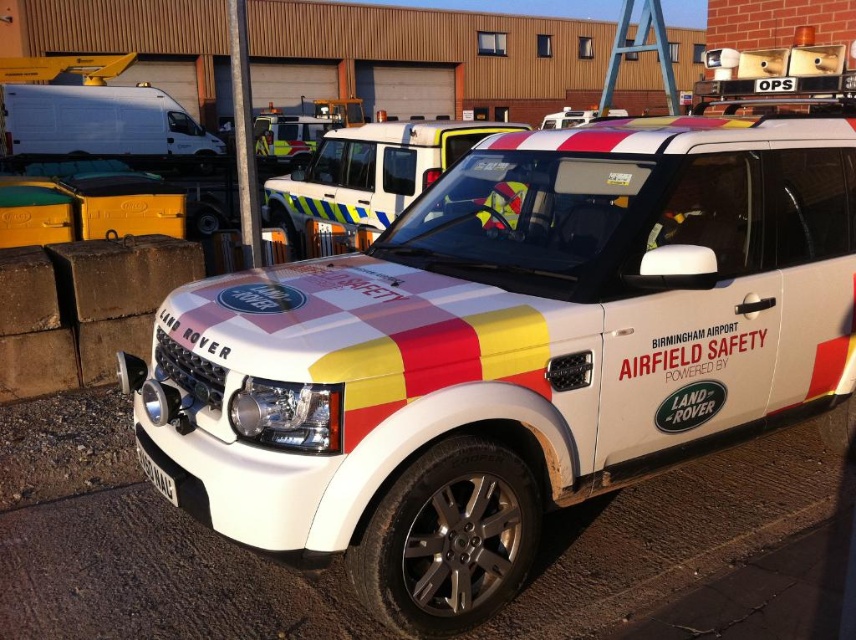
Question: Does matte white vehicle at center have a greater width compared to yellow reflective safety vest at center?

Choices:
 (A) no
 (B) yes

Answer: (A)

Question: Does white glossy suv at center lie behind yellow reflective safety vest at center?

Choices:
 (A) yes
 (B) no

Answer: (B)

Question: Considering the relative positions of white glossy suv at center and black plastic license plate at lower center in the image provided, where is white glossy suv at center located with respect to black plastic license plate at lower center?

Choices:
 (A) right
 (B) left

Answer: (A)

Question: Which point is farther to the camera?

Choices:
 (A) (519, 131)
 (B) (441, 253)
 (C) (308, 138)
 (D) (170, 481)

Answer: (C)

Question: Among these objects, which one is nearest to the camera?

Choices:
 (A) matte white vehicle at center
 (B) yellow reflective safety vest at center
 (C) white glossy suv at center

Answer: (C)

Question: Which point is closer to the camera?

Choices:
 (A) (164, 472)
 (B) (407, 192)

Answer: (A)